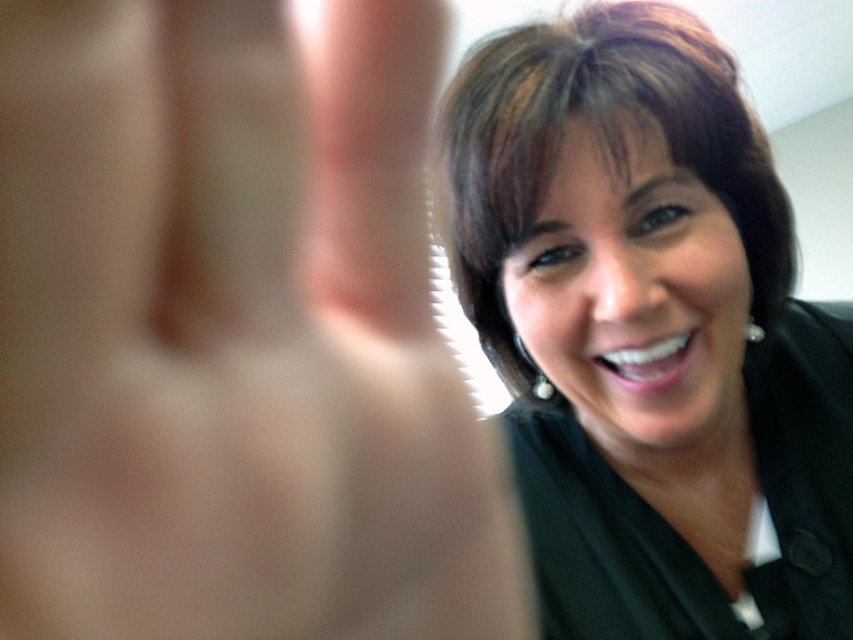
Question: Which object is farther from the camera taking this photo?

Choices:
 (A) brown shiny hair at upper right
 (B) smooth skin hand at center

Answer: (A)

Question: Is the position of smooth skin hand at center less distant than that of brown shiny hair at upper right?

Choices:
 (A) no
 (B) yes

Answer: (B)

Question: Which of the following is the closest to the observer?

Choices:
 (A) (683, 54)
 (B) (44, 140)

Answer: (B)

Question: Is smooth skin hand at center wider than brown shiny hair at upper right?

Choices:
 (A) yes
 (B) no

Answer: (B)

Question: Is the position of smooth skin hand at center less distant than that of brown shiny hair at upper right?

Choices:
 (A) no
 (B) yes

Answer: (B)

Question: Among these objects, which one is farthest from the camera?

Choices:
 (A) smooth skin hand at center
 (B) brown shiny hair at upper right

Answer: (B)